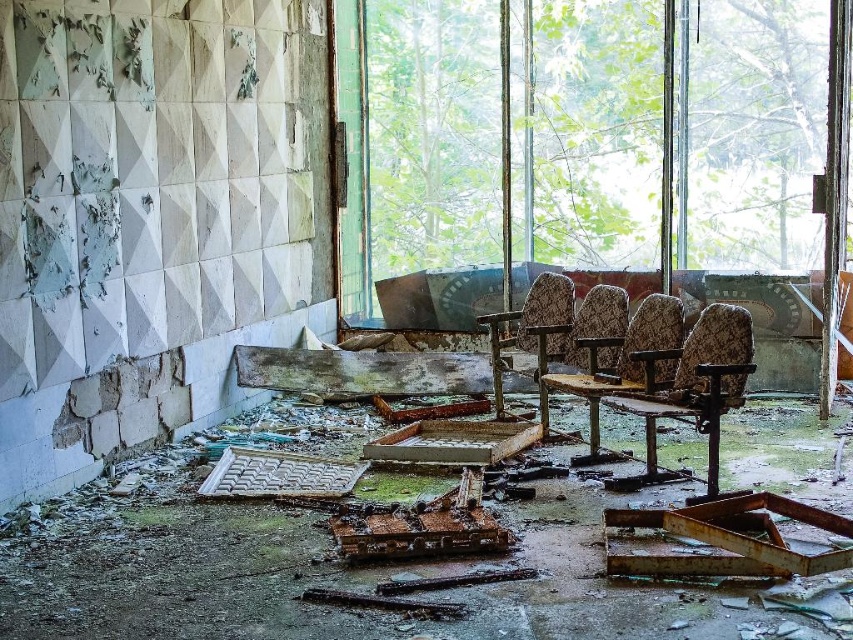
Between transparent glass window at center and patterned fabric chair at center, which one appears on the left side from the viewer's perspective?

patterned fabric chair at center is more to the left.

Is point (412, 36) more distant than point (534, 296)?

Yes, point (412, 36) is behind point (534, 296).

At what (x,y) coordinates should I click in order to perform the action: click on transparent glass window at center. Please return your answer as a coordinate pair (x, y). The image size is (853, 640). Looking at the image, I should click on (424, 154).

Locate an element on the screen. This screenshot has height=640, width=853. transparent glass window at center is located at coordinates (424, 154).

Between point (440, 44) and point (662, 365), which one is positioned in front?

Point (662, 365) is more forward.

Is transparent glass window at center positioned behind floral fabric chair at center?

Yes.

Is point (357, 140) less distant than point (595, 420)?

That is False.

Locate an element on the screen. transparent glass window at center is located at coordinates (424, 154).

Is transparent glass window at center thinner than camouflage fabric chair at center?

In fact, transparent glass window at center might be wider than camouflage fabric chair at center.

Is transparent glass window at center further to camera compared to camouflage fabric chair at center?

That is True.

Which is in front, point (753, 22) or point (741, 392)?

Point (741, 392)

The height and width of the screenshot is (640, 853). Identify the location of transparent glass window at center. (424, 154).